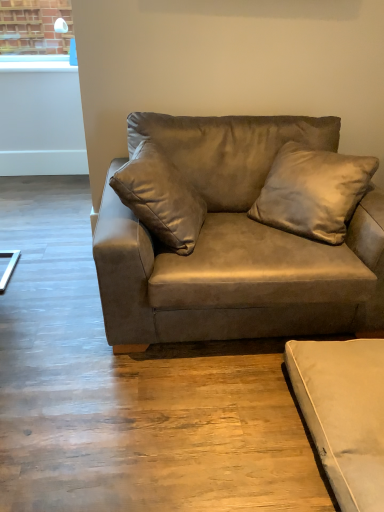
Where is `free space to the left of beige suede studio couch at lower right, which is the 1th studio couch from bottom to top`? This screenshot has height=512, width=384. free space to the left of beige suede studio couch at lower right, which is the 1th studio couch from bottom to top is located at coordinates click(234, 419).